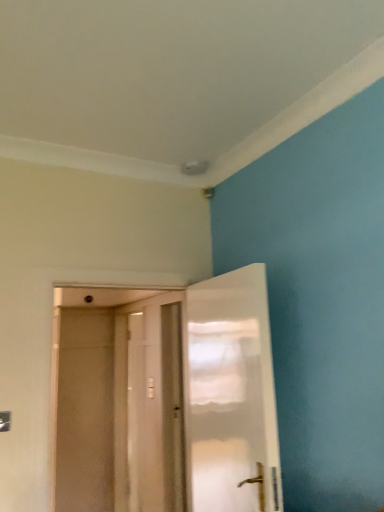
Where is `white glossy door at center, which is the 2th door in front-to-back order`? white glossy door at center, which is the 2th door in front-to-back order is located at coordinates (149, 406).

The image size is (384, 512). Describe the element at coordinates (149, 406) in the screenshot. I see `white glossy door at center, which is the 2th door in front-to-back order` at that location.

Where is `transparent plastic screen door at center`? Image resolution: width=384 pixels, height=512 pixels. transparent plastic screen door at center is located at coordinates (85, 411).

Consider the image. From a real-world perspective, is transparent plastic screen door at center physically located above or below white glossy door at center, which is the 2th door in front-to-back order?

In terms of real-world spatial position, transparent plastic screen door at center is above white glossy door at center, which is the 2th door in front-to-back order.

Is transparent plastic screen door at center positioned beyond the bounds of white glossy door at center, which is counted as the 1th door, starting from the back?

Yes.

Is point (106, 371) more distant than point (164, 510)?

That is True.

Considering the relative sizes of white matte door at center, acting as the 1th door starting from the front, and white glossy door at center, which is counted as the 1th door, starting from the back, in the image provided, is white matte door at center, acting as the 1th door starting from the front, taller than white glossy door at center, which is counted as the 1th door, starting from the back,?

No.

From a real-world perspective, is white matte door at center, acting as the 1th door starting from the front, on white glossy door at center, which is the 2th door in front-to-back order?

Yes.

In the scene shown: From the image's perspective, would you say white matte door at center, the second door positioned from the back, is positioned over white glossy door at center, which is the 2th door in front-to-back order?

Indeed, from the image's perspective, white matte door at center, the second door positioned from the back, is shown above white glossy door at center, which is the 2th door in front-to-back order.

Is the depth of white glossy door at center, which is counted as the 1th door, starting from the back, greater than that of transparent plastic screen door at center?

No, white glossy door at center, which is counted as the 1th door, starting from the back, is closer to the viewer.

Measure the distance between white glossy door at center, which is counted as the 1th door, starting from the back, and transparent plastic screen door at center.

They are 22.75 inches apart.

From the image's perspective, which one is positioned lower, white glossy door at center, which is the 2th door in front-to-back order, or transparent plastic screen door at center?

transparent plastic screen door at center is shown below in the image.

Is point (152, 503) more distant than point (59, 498)?

No, (152, 503) is in front of (59, 498).

From a real-world perspective, is white matte door at center, acting as the 1th door starting from the front, physically above transparent plastic screen door at center?

Correct, in the physical world, white matte door at center, acting as the 1th door starting from the front, is higher than transparent plastic screen door at center.

Is white matte door at center, acting as the 1th door starting from the front, next to transparent plastic screen door at center and touching it?

Yes, white matte door at center, acting as the 1th door starting from the front, is beside transparent plastic screen door at center.

In the scene shown: Could you measure the distance between transparent plastic screen door at center and white matte door at center, acting as the 1th door starting from the front?

1.65 inches.

Based on the photo, is transparent plastic screen door at center taller or shorter than white matte door at center, acting as the 1th door starting from the front?

Considering their sizes, transparent plastic screen door at center has more height than white matte door at center, acting as the 1th door starting from the front.

Which object is positioned more to the left, transparent plastic screen door at center or white matte door at center, the second door positioned from the back?

transparent plastic screen door at center.

From the image's perspective, which is above, transparent plastic screen door at center or white matte door at center, acting as the 1th door starting from the front?

From the image's view, white matte door at center, acting as the 1th door starting from the front, is above.

Locate an element on the screen. door lying in front of the white glossy door at center, which is counted as the 1th door, starting from the back is located at coordinates (166, 399).

From a real-world perspective, which is physically below, white glossy door at center, which is counted as the 1th door, starting from the back, or white matte door at center, acting as the 1th door starting from the front?

white glossy door at center, which is counted as the 1th door, starting from the back, is physically lower.

Is white glossy door at center, which is the 2th door in front-to-back order, bigger than white matte door at center, the second door positioned from the back?

Yes.

Does white glossy door at center, which is counted as the 1th door, starting from the back, have a lesser width compared to white matte door at center, acting as the 1th door starting from the front?

Indeed, white glossy door at center, which is counted as the 1th door, starting from the back, has a lesser width compared to white matte door at center, acting as the 1th door starting from the front.

Starting from the transparent plastic screen door at center, which door is the 1st one to the right? Please provide its 2D coordinates.

[(149, 406)]

Locate an element on the screen. The width and height of the screenshot is (384, 512). door behind the white matte door at center, the second door positioned from the back is located at coordinates (149, 406).

Which object lies further to the anchor point white glossy door at center, which is the 2th door in front-to-back order, transparent plastic screen door at center or white matte door at center, the second door positioned from the back?

white matte door at center, the second door positioned from the back, is further to white glossy door at center, which is the 2th door in front-to-back order.

In the scene shown: Considering their positions, is white matte door at center, acting as the 1th door starting from the front, positioned further to transparent plastic screen door at center than white glossy door at center, which is the 2th door in front-to-back order?

white glossy door at center, which is the 2th door in front-to-back order, lies further to transparent plastic screen door at center than the other object.

Considering their positions, is white matte door at center, acting as the 1th door starting from the front, positioned further to white glossy door at center, which is counted as the 1th door, starting from the back, than transparent plastic screen door at center?

Based on the image, white matte door at center, acting as the 1th door starting from the front, appears to be further to white glossy door at center, which is counted as the 1th door, starting from the back.

Considering their positions, is white glossy door at center, which is counted as the 1th door, starting from the back, positioned further to white matte door at center, acting as the 1th door starting from the front, than transparent plastic screen door at center?

Result: Among the two, white glossy door at center, which is counted as the 1th door, starting from the back, is located further to white matte door at center, acting as the 1th door starting from the front.

In the scene shown: Which object lies further to the anchor point transparent plastic screen door at center, white glossy door at center, which is counted as the 1th door, starting from the back, or white matte door at center, acting as the 1th door starting from the front?

white glossy door at center, which is counted as the 1th door, starting from the back, is further to transparent plastic screen door at center.

Estimate the real-world distances between objects in this image. Which object is closer to white matte door at center, the second door positioned from the back, transparent plastic screen door at center or white glossy door at center, which is the 2th door in front-to-back order?

transparent plastic screen door at center is closer to white matte door at center, the second door positioned from the back.

You are a GUI agent. You are given a task and a screenshot of the screen. Output one action in this format:
    pyautogui.click(x=<x>, y=<y>)
    Task: Click on the door positioned between white matte door at center, acting as the 1th door starting from the front, and transparent plastic screen door at center from near to far
    The width and height of the screenshot is (384, 512).
    Given the screenshot: What is the action you would take?
    pyautogui.click(x=149, y=406)